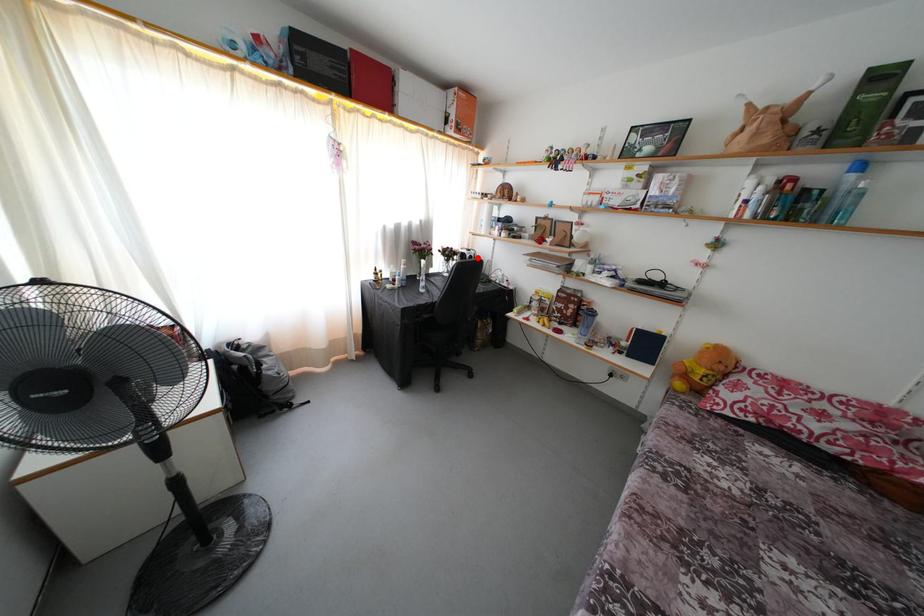
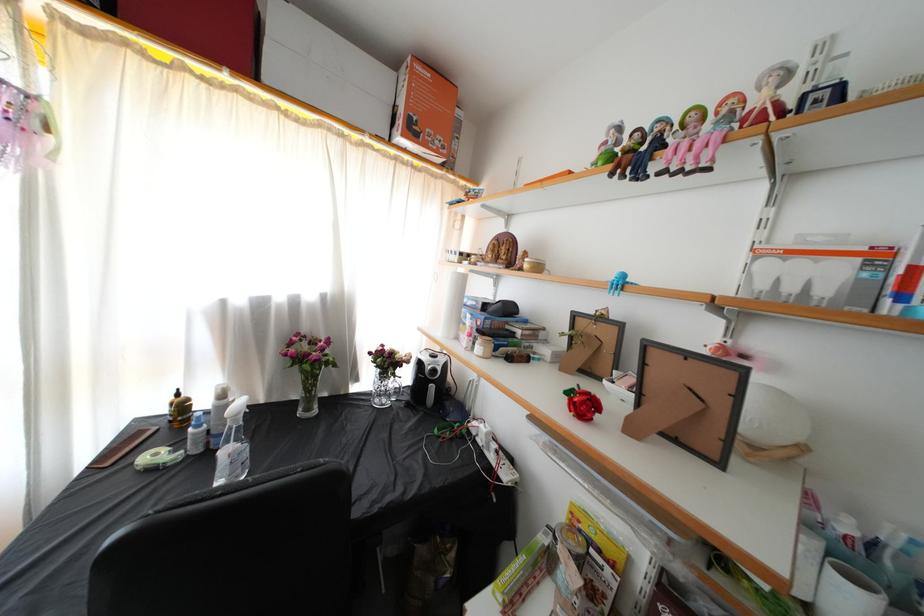
Question: I am providing you with two images of the same scene from different viewpoints. In image1, a red point is highlighted. Considering the same 3D point in image2, which of the following is correct?

Choices:
 (A) It is closer
 (B) It is farther

Answer: (B)